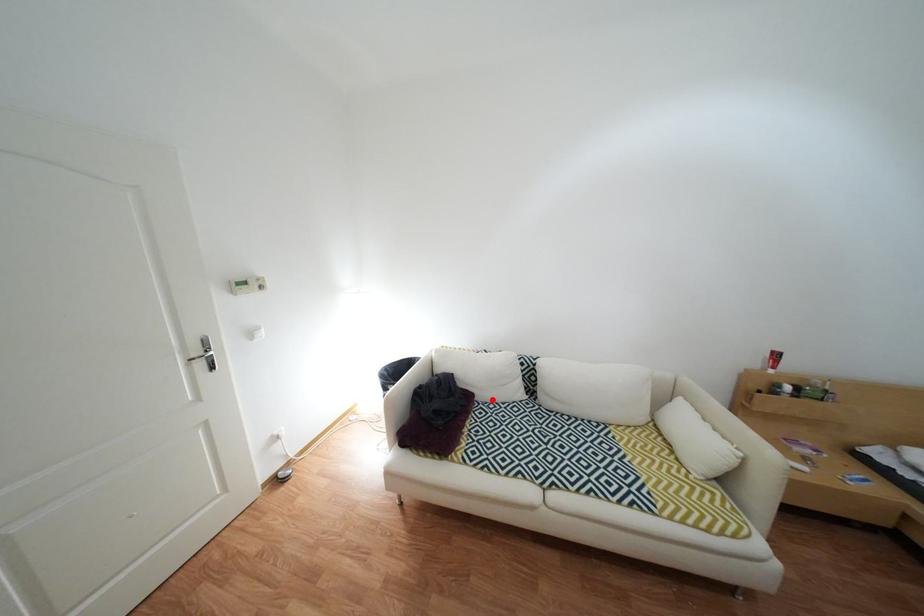
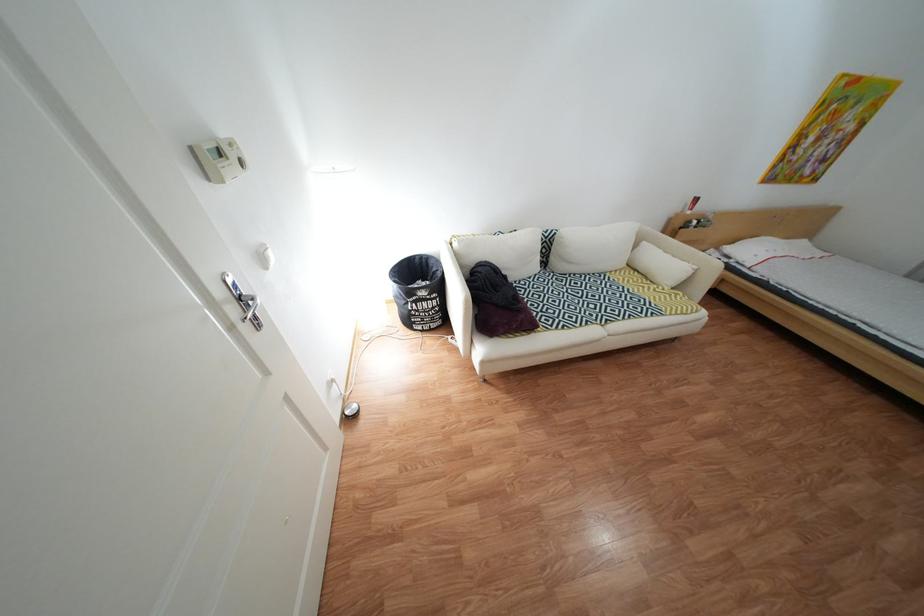
Question: A red point is marked in image1. In image2, is the corresponding 3D point closer to the camera or farther? Reply with the corresponding letter.

Choices:
 (A) The corresponding 3D point is closer.
 (B) The corresponding 3D point is farther.

Answer: (A)